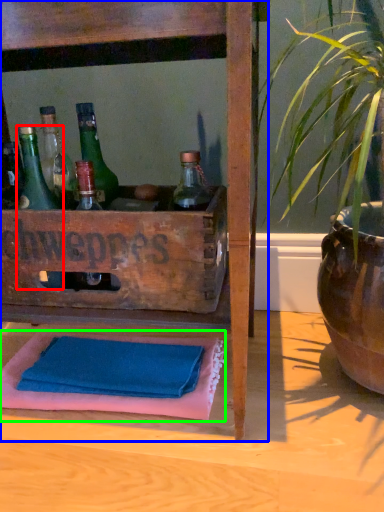
Question: Considering the real-world distances, which object is farthest from bottle (highlighted by a red box)? furniture (highlighted by a blue box) or bath towel (highlighted by a green box)?

Choices:
 (A) furniture
 (B) bath towel

Answer: (B)